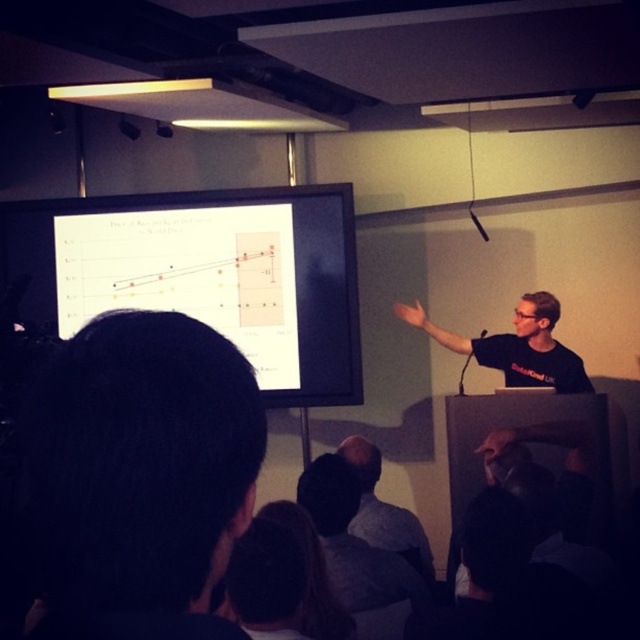
Does dark hair at lower left have a greater height compared to white glossy projection screen at upper center?

Incorrect, dark hair at lower left's height is not larger of white glossy projection screen at upper center's.

Does point (44, 483) lie in front of point (353, 394)?

Yes, it is.

Where is `dark hair at lower left`? dark hair at lower left is located at coordinates (140, 476).

Where is `white glossy projection screen at upper center`? Image resolution: width=640 pixels, height=640 pixels. white glossy projection screen at upper center is located at coordinates (205, 273).

Does point (184, 307) come behind point (524, 360)?

Yes.

Is point (45, 266) positioned before point (547, 348)?

No.

Find the location of a particular element. white glossy projection screen at upper center is located at coordinates (205, 273).

Consider the image. Does white glossy projection screen at upper center have a smaller size compared to gray shirt at center?

No.

Between point (20, 224) and point (360, 525), which one is positioned behind?

The point (20, 224) is behind.

Is point (300, 211) behind point (378, 538)?

Yes, it is.

You are a GUI agent. You are given a task and a screenshot of the screen. Output one action in this format:
    pyautogui.click(x=<x>, y=<y>)
    Task: Click on the white glossy projection screen at upper center
    The height and width of the screenshot is (640, 640).
    Given the screenshot: What is the action you would take?
    point(205,273)